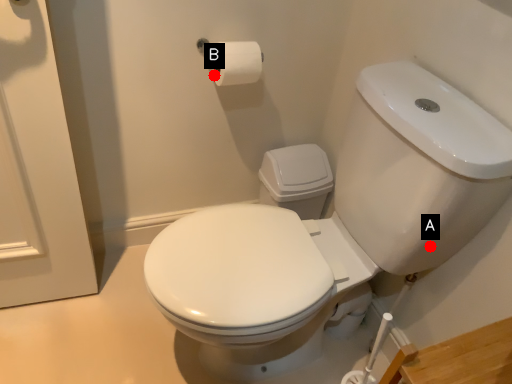
Question: Two points are circled on the image, labeled by A and B beside each circle. Which point is closer to the camera?

Choices:
 (A) A is closer
 (B) B is closer

Answer: (A)